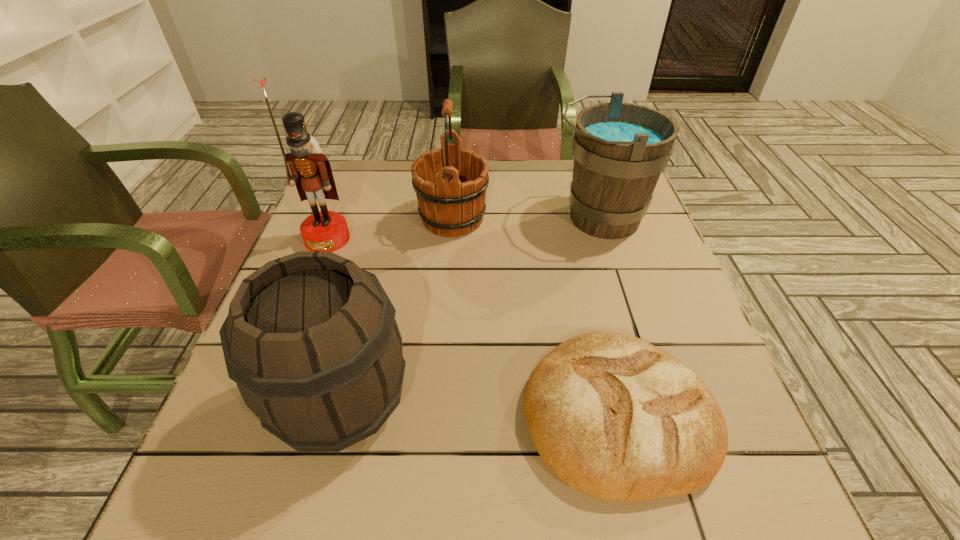
Find the location of a particular element. The width and height of the screenshot is (960, 540). free region at the near edge is located at coordinates (323, 499).

The width and height of the screenshot is (960, 540). Identify the location of vacant space at the left edge of the desktop. (348, 222).

In the image, there is a desktop. At what (x,y) coordinates should I click in order to perform the action: click on blank space at the right edge. Please return your answer as a coordinate pair (x, y). Looking at the image, I should click on (684, 355).

The width and height of the screenshot is (960, 540). What are the coordinates of `vacant space at the far left corner` in the screenshot? It's located at (381, 165).

In the image, there is a desktop. At what (x,y) coordinates should I click in order to perform the action: click on vacant space at the near right corner. Please return your answer as a coordinate pair (x, y). Looking at the image, I should click on (704, 505).

Identify the location of vacant region between the bread and the nutcracker. This screenshot has width=960, height=540. (472, 327).

At what (x,y) coordinates should I click in order to perform the action: click on unoccupied position between the shortest object and the nearest wine bucket. Please return your answer as a coordinate pair (x, y). The image size is (960, 540). Looking at the image, I should click on (480, 408).

At what (x,y) coordinates should I click in order to perform the action: click on free spot between the nearest wine bucket and the shortest object. Please return your answer as a coordinate pair (x, y). The image size is (960, 540). Looking at the image, I should click on tap(480, 408).

Locate an element on the screen. Image resolution: width=960 pixels, height=540 pixels. vacant area that lies between the tallest object and the bread is located at coordinates (472, 327).

This screenshot has height=540, width=960. Find the location of `free space between the bread and the nutcracker`. free space between the bread and the nutcracker is located at coordinates (472, 327).